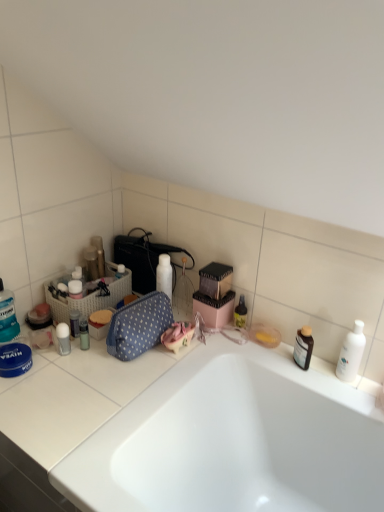
Image resolution: width=384 pixels, height=512 pixels. I want to click on translucent plastic mouthwash at left, the first toiletry viewed from the left, so click(7, 315).

Locate an element on the screen. This screenshot has width=384, height=512. metallic silver container at left, positioned as the sixth toiletry in right-to-left order is located at coordinates (84, 333).

In order to face white woven laundry basket at left, should I rotate leftwards or rightwards?

To align with it, rotate left about 13.377°.

Image resolution: width=384 pixels, height=512 pixels. Find the location of `white woven laundry basket at left`. white woven laundry basket at left is located at coordinates (89, 295).

Image resolution: width=384 pixels, height=512 pixels. Describe the element at coordinates (164, 275) in the screenshot. I see `white glossy bottle at center, arranged as the seventh toiletry when viewed from the left` at that location.

You are a GUI agent. You are given a task and a screenshot of the screen. Output one action in this format:
    pyautogui.click(x=<x>, y=<y>)
    Task: Click on the translucent plastic tube at left, which appears as the 8th toiletry when viewed from the right
    The image size is (384, 512).
    Given the screenshot: What is the action you would take?
    pyautogui.click(x=74, y=323)

You are a GUI agent. You are given a task and a screenshot of the screen. Output one action in this format:
    pyautogui.click(x=<x>, y=<y>)
    Task: Click on the translucent plastic mouthwash at left, which is counted as the tenth toiletry, starting from the right
    The width and height of the screenshot is (384, 512).
    Given the screenshot: What is the action you would take?
    pyautogui.click(x=7, y=315)

Is white woven laundry basket at left next to translucent plastic bottle at upper right, the 3th toiletry in the right-to-left sequence, and touching it?

They are not placed beside each other.

From a real-world perspective, does white woven laundry basket at left stand above translucent plastic bottle at upper right, the 3th toiletry in the right-to-left sequence?

Yes, from a real-world perspective, white woven laundry basket at left is over translucent plastic bottle at upper right, the 3th toiletry in the right-to-left sequence

Based on their sizes in the image, would you say white woven laundry basket at left is bigger or smaller than translucent plastic bottle at upper right, the 3th toiletry in the right-to-left sequence?

In the image, white woven laundry basket at left appears to be larger than translucent plastic bottle at upper right, the 3th toiletry in the right-to-left sequence.

How different are the orientations of white woven laundry basket at left and translucent plastic bottle at upper right, the 8th toiletry in the left-to-right sequence, in degrees?

1.25 degrees.

From the image's perspective, is translucent plastic tube at left, the 3th toiletry in the left-to-right sequence, beneath metallic silver container at left, positioned as the sixth toiletry in right-to-left order?

Incorrect, from the image's perspective, translucent plastic tube at left, the 3th toiletry in the left-to-right sequence, is higher than metallic silver container at left, positioned as the sixth toiletry in right-to-left order.

Which object is closer to the camera, translucent plastic tube at left, the 3th toiletry in the left-to-right sequence, or metallic silver container at left, positioned as the sixth toiletry in right-to-left order?

metallic silver container at left, positioned as the sixth toiletry in right-to-left order.

Could you tell me if translucent plastic tube at left, which appears as the 8th toiletry when viewed from the right, is facing metallic silver container at left, positioned as the sixth toiletry in right-to-left order?

No.

Which is more to the left, translucent plastic tube at left, the 3th toiletry in the left-to-right sequence, or metallic silver container at left, the 5th toiletry viewed from the left?

From the viewer's perspective, translucent plastic tube at left, the 3th toiletry in the left-to-right sequence, appears more on the left side.

Does blue polka dot fabric bag at center turn towards white glossy bottle at right, which is the 10th toiletry in left-to-right order?

No, blue polka dot fabric bag at center is not facing towards white glossy bottle at right, which is the 10th toiletry in left-to-right order.

Does blue polka dot fabric bag at center contain white glossy bottle at right, which is the 10th toiletry in left-to-right order?

That's incorrect, white glossy bottle at right, which is the 10th toiletry in left-to-right order, is not inside blue polka dot fabric bag at center.

Which object is closer to the camera, blue polka dot fabric bag at center or white glossy bottle at right, which is the 10th toiletry in left-to-right order?

white glossy bottle at right, which is the 10th toiletry in left-to-right order, is in front.

Where is `bag that is behind the white glossy bottle at right, which is the 10th toiletry in left-to-right order`? bag that is behind the white glossy bottle at right, which is the 10th toiletry in left-to-right order is located at coordinates (139, 326).

Visually, is translucent plastic mouthwash at left, the first toiletry viewed from the left, positioned to the left or to the right of translucent plastic tube at left, which appears as the 8th toiletry when viewed from the right?

Clearly, translucent plastic mouthwash at left, the first toiletry viewed from the left, is on the left of translucent plastic tube at left, which appears as the 8th toiletry when viewed from the right, in the image.

Is translucent plastic mouthwash at left, which is counted as the tenth toiletry, starting from the right, bigger than translucent plastic tube at left, which appears as the 8th toiletry when viewed from the right?

Yes.

From the picture: Considering the relative positions of translucent plastic mouthwash at left, the first toiletry viewed from the left, and translucent plastic tube at left, which appears as the 8th toiletry when viewed from the right, in the image provided, is translucent plastic mouthwash at left, the first toiletry viewed from the left, behind translucent plastic tube at left, which appears as the 8th toiletry when viewed from the right,?

No, it is in front of translucent plastic tube at left, which appears as the 8th toiletry when viewed from the right.

From a real-world perspective, who is located lower, translucent plastic mouthwash at left, which is counted as the tenth toiletry, starting from the right, or translucent plastic tube at left, the 3th toiletry in the left-to-right sequence?

translucent plastic tube at left, the 3th toiletry in the left-to-right sequence.

Looking at this image, would you consider matte black speaker at upper left, the 5th toiletry in the right-to-left sequence, to be distant from metallic silver container at left, the 5th toiletry viewed from the left?

No, there isn't a large distance between matte black speaker at upper left, the 5th toiletry in the right-to-left sequence, and metallic silver container at left, the 5th toiletry viewed from the left.

How many degrees apart are the facing directions of matte black speaker at upper left, the 5th toiletry in the right-to-left sequence, and metallic silver container at left, the 5th toiletry viewed from the left?

The facing directions of matte black speaker at upper left, the 5th toiletry in the right-to-left sequence, and metallic silver container at left, the 5th toiletry viewed from the left, are 0.00731 degrees apart.

In the image, is matte black speaker at upper left, the 6th toiletry positioned from the left, positioned in front of or behind metallic silver container at left, the 5th toiletry viewed from the left?

matte black speaker at upper left, the 6th toiletry positioned from the left, is positioned farther from the viewer than metallic silver container at left, the 5th toiletry viewed from the left.

Looking at the image, does matte black speaker at upper left, the 6th toiletry positioned from the left, seem bigger or smaller compared to metallic silver container at left, positioned as the sixth toiletry in right-to-left order?

matte black speaker at upper left, the 6th toiletry positioned from the left, is smaller than metallic silver container at left, positioned as the sixth toiletry in right-to-left order.

From the image's perspective, would you say white glossy bathtub at lower left is shown under translucent plastic mouthwash at left, the first toiletry viewed from the left?

Yes.

From a real-world perspective, which is physically above, white glossy bathtub at lower left or translucent plastic mouthwash at left, the first toiletry viewed from the left?

translucent plastic mouthwash at left, the first toiletry viewed from the left, is physically above.

Between white glossy bathtub at lower left and translucent plastic mouthwash at left, which is counted as the tenth toiletry, starting from the right, which one has smaller size?

With smaller size is translucent plastic mouthwash at left, which is counted as the tenth toiletry, starting from the right.

What's the angular difference between white glossy bathtub at lower left and translucent plastic mouthwash at left, the first toiletry viewed from the left,'s facing directions?

white glossy bathtub at lower left and translucent plastic mouthwash at left, the first toiletry viewed from the left, are facing 0.405 degrees away from each other.

There is a matte black speaker at upper left, the 6th toiletry positioned from the left. What are the coordinates of `the 2nd toiletry above it (from a real-world perspective)` in the screenshot? It's located at (99, 254).

Can you confirm if metallic cylindrical container at upper left, acting as the seventh toiletry starting from the right, is positioned to the right of matte black speaker at upper left, the 6th toiletry positioned from the left?

No, metallic cylindrical container at upper left, acting as the seventh toiletry starting from the right, is not to the right of matte black speaker at upper left, the 6th toiletry positioned from the left.

Between metallic cylindrical container at upper left, positioned as the fourth toiletry in left-to-right order, and matte black speaker at upper left, the 6th toiletry positioned from the left, which one has smaller width?

matte black speaker at upper left, the 6th toiletry positioned from the left, is thinner.

You are a GUI agent. You are given a task and a screenshot of the screen. Output one action in this format:
    pyautogui.click(x=<x>, y=<y>)
    Task: Click on the 5th toiletry counting from the right side of the white woven laundry basket at left
    This screenshot has height=512, width=384.
    Given the screenshot: What is the action you would take?
    pyautogui.click(x=240, y=313)

From a real-world perspective, count 2nd toiletrys downward from the metallic silver container at left, the 5th toiletry viewed from the left, and point to it. Please provide its 2D coordinates.

[(74, 323)]

Estimate the real-world distances between objects in this image. Which object is further from white glossy bottle at center, arranged as the seventh toiletry when viewed from the left, brown glass bottle at right, positioned as the 9th toiletry in left-to-right order, or matte black speaker at upper left, the 6th toiletry positioned from the left?

Based on the image, brown glass bottle at right, positioned as the 9th toiletry in left-to-right order, appears to be further to white glossy bottle at center, arranged as the seventh toiletry when viewed from the left.

Based on their spatial positions, is white glossy deodorant at left, which is the ninth toiletry in right-to-left order, or white glossy bottle at right, which is the 10th toiletry in left-to-right order, further from white glossy bathtub at lower left?

white glossy deodorant at left, which is the ninth toiletry in right-to-left order.

From the image, which object appears to be farther from translucent plastic tube at left, which appears as the 8th toiletry when viewed from the right, white glossy bottle at center, which is the fourth toiletry in right-to-left order, or brown glass bottle at right, positioned as the 9th toiletry in left-to-right order?

brown glass bottle at right, positioned as the 9th toiletry in left-to-right order.

Which object lies further to the anchor point brown glass bottle at right, positioned as the 9th toiletry in left-to-right order, metallic silver container at left, the 5th toiletry viewed from the left, or white glossy deodorant at left, which is the 2th toiletry in left-to-right order?

white glossy deodorant at left, which is the 2th toiletry in left-to-right order.

Based on their spatial positions, is translucent plastic tube at left, the 3th toiletry in the left-to-right sequence, or white glossy bathtub at lower left closer to matte black speaker at upper left, the 6th toiletry positioned from the left?

Based on the image, translucent plastic tube at left, the 3th toiletry in the left-to-right sequence, appears to be nearer to matte black speaker at upper left, the 6th toiletry positioned from the left.

Looking at the image, which one is located further to white glossy deodorant at left, which is the ninth toiletry in right-to-left order, white woven laundry basket at left or blue polka dot fabric bag at center?

blue polka dot fabric bag at center lies further to white glossy deodorant at left, which is the ninth toiletry in right-to-left order, than the other object.

When comparing their distances from metallic cylindrical container at upper left, acting as the seventh toiletry starting from the right, does white woven laundry basket at left or brown glass bottle at right, the 2th toiletry when ordered from right to left, seem closer?

white woven laundry basket at left.

Considering their positions, is white glossy bottle at center, arranged as the seventh toiletry when viewed from the left, positioned closer to blue polka dot fabric bag at center than white glossy deodorant at left, which is the ninth toiletry in right-to-left order?

white glossy bottle at center, arranged as the seventh toiletry when viewed from the left.

Where is `laundry basket located between translucent plastic tube at left, which appears as the 8th toiletry when viewed from the right, and translucent plastic bottle at upper right, the 8th toiletry in the left-to-right sequence, in the left-right direction`? laundry basket located between translucent plastic tube at left, which appears as the 8th toiletry when viewed from the right, and translucent plastic bottle at upper right, the 8th toiletry in the left-to-right sequence, in the left-right direction is located at coordinates (89, 295).

Where is `bag positioned between white glossy bathtub at lower left and brown glass bottle at right, positioned as the 9th toiletry in left-to-right order, from near to far`? The height and width of the screenshot is (512, 384). bag positioned between white glossy bathtub at lower left and brown glass bottle at right, positioned as the 9th toiletry in left-to-right order, from near to far is located at coordinates (139, 326).

Where is `bag between white glossy bathtub at lower left and translucent plastic tube at left, the 3th toiletry in the left-to-right sequence, in the front-back direction`? The image size is (384, 512). bag between white glossy bathtub at lower left and translucent plastic tube at left, the 3th toiletry in the left-to-right sequence, in the front-back direction is located at coordinates (139, 326).

This screenshot has height=512, width=384. Find the location of `bag between translucent plastic tube at left, the 3th toiletry in the left-to-right sequence, and translucent plastic bottle at upper right, the 3th toiletry in the right-to-left sequence, from left to right`. bag between translucent plastic tube at left, the 3th toiletry in the left-to-right sequence, and translucent plastic bottle at upper right, the 3th toiletry in the right-to-left sequence, from left to right is located at coordinates (139, 326).